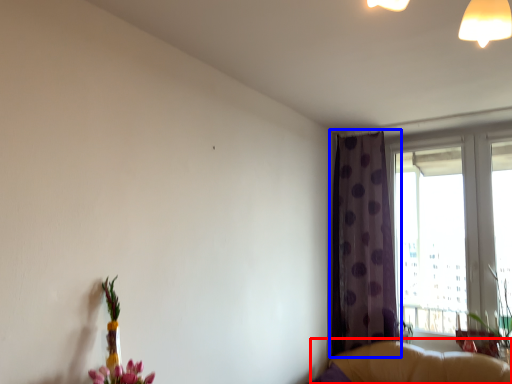
Question: Which object is further to the camera taking this photo, couch (highlighted by a red box) or curtain (highlighted by a blue box)?

Choices:
 (A) couch
 (B) curtain

Answer: (B)